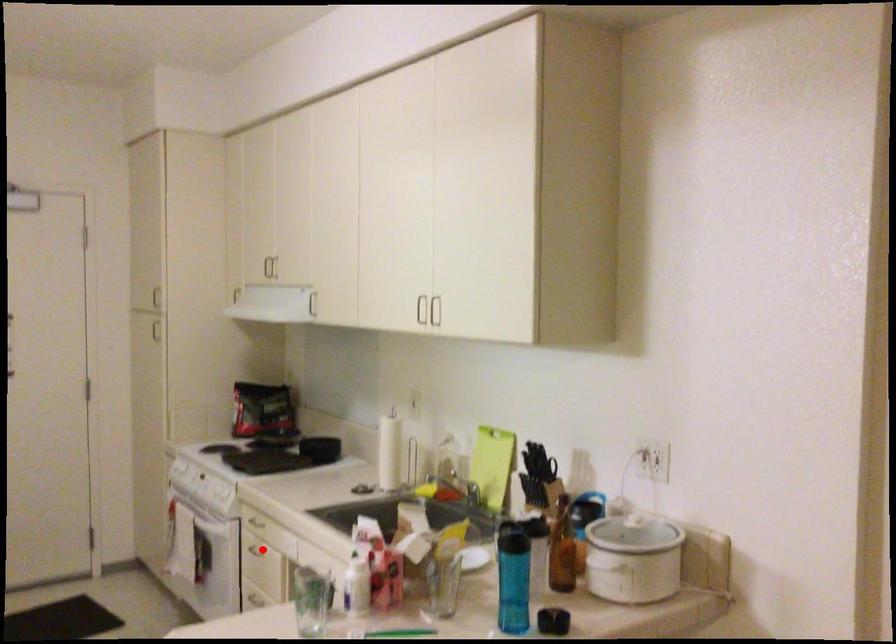
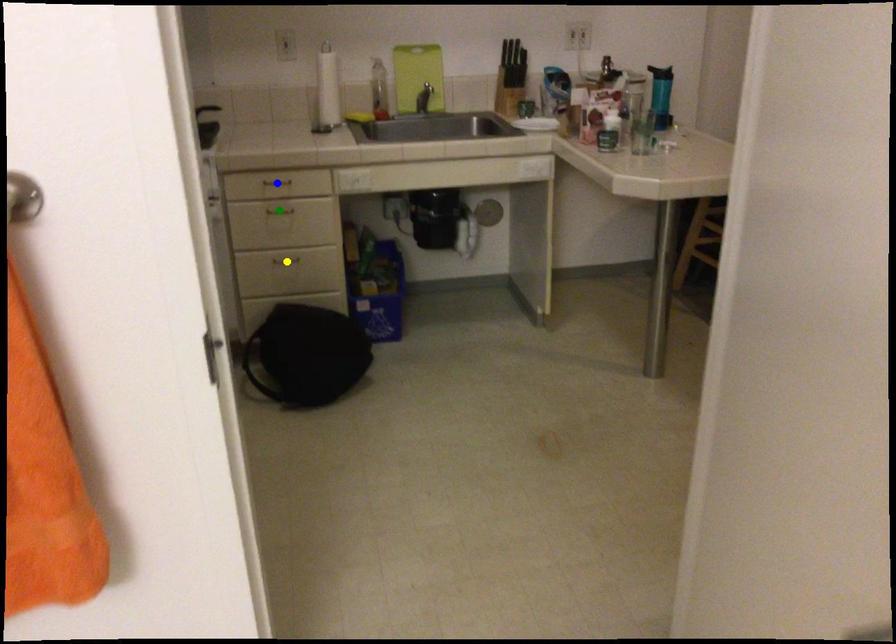
Question: I am providing you with two images of the same scene from different viewpoints. A red point is marked on the first image. You are given multiple points on the second image. Which spot in image 2 lines up with the point in image 1?

Choices:
 (A) yellow point
 (B) blue point
 (C) green point

Answer: (C)